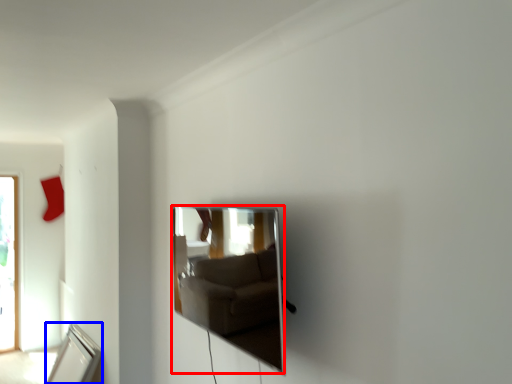
Question: Which object is further to the camera taking this photo, mirror (highlighted by a red box) or mirror (highlighted by a blue box)?

Choices:
 (A) mirror
 (B) mirror

Answer: (B)